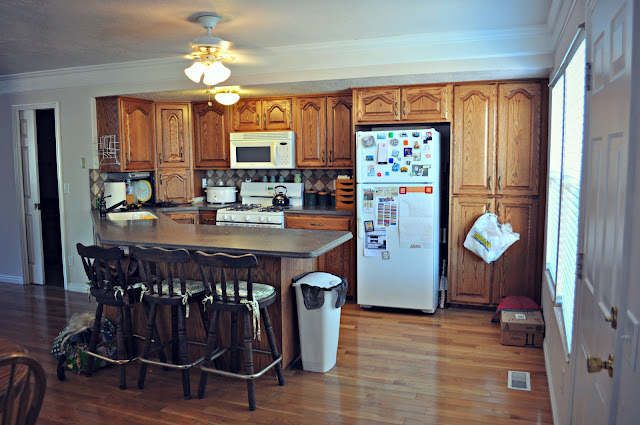
Locate an element on the screen. The image size is (640, 425). fridge is located at coordinates (410, 275).